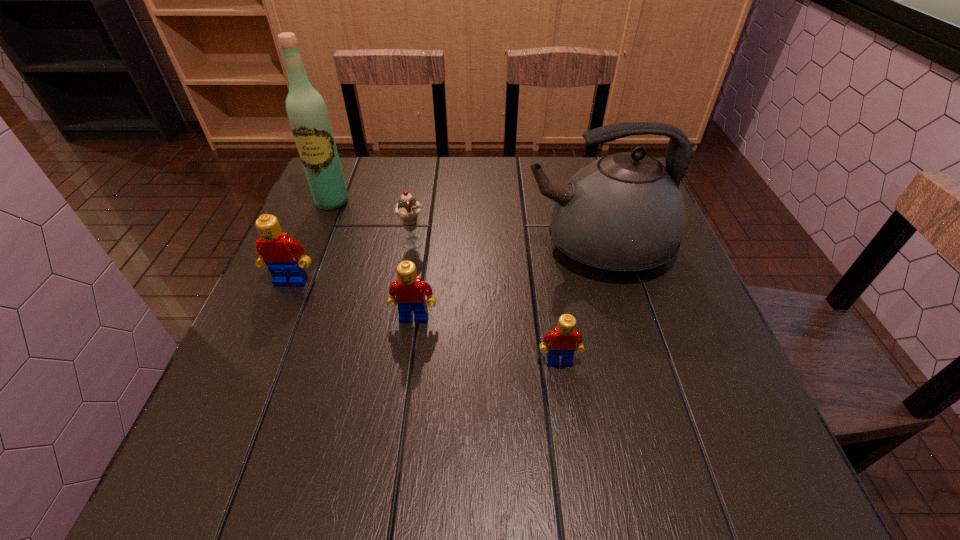
Please point a spot to add another Lego on the right. Please provide its 2D coordinates. Your answer should be formatted as a tuple, i.e. [(x, y)], where the tuple contains the x and y coordinates of a point satisfying the conditions above.

[(732, 413)]